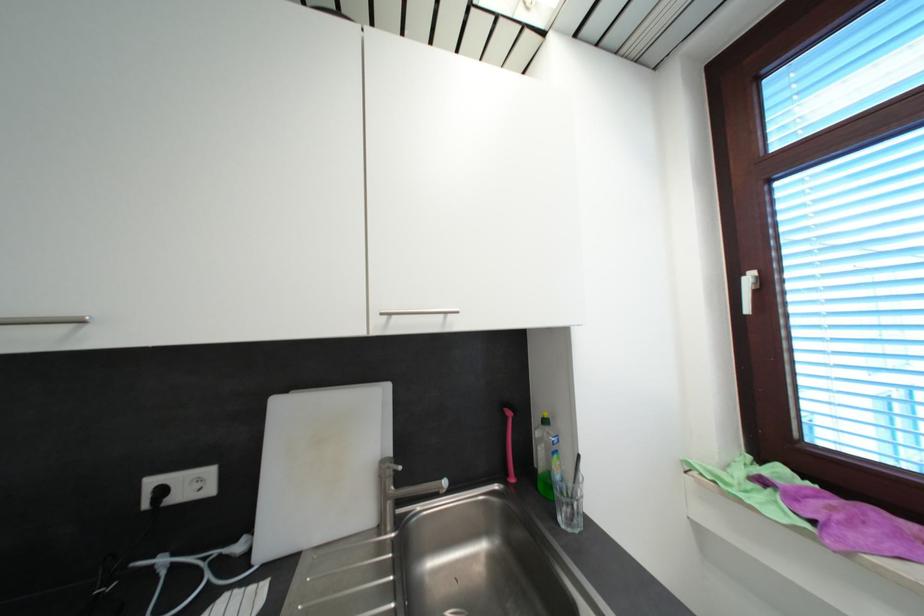
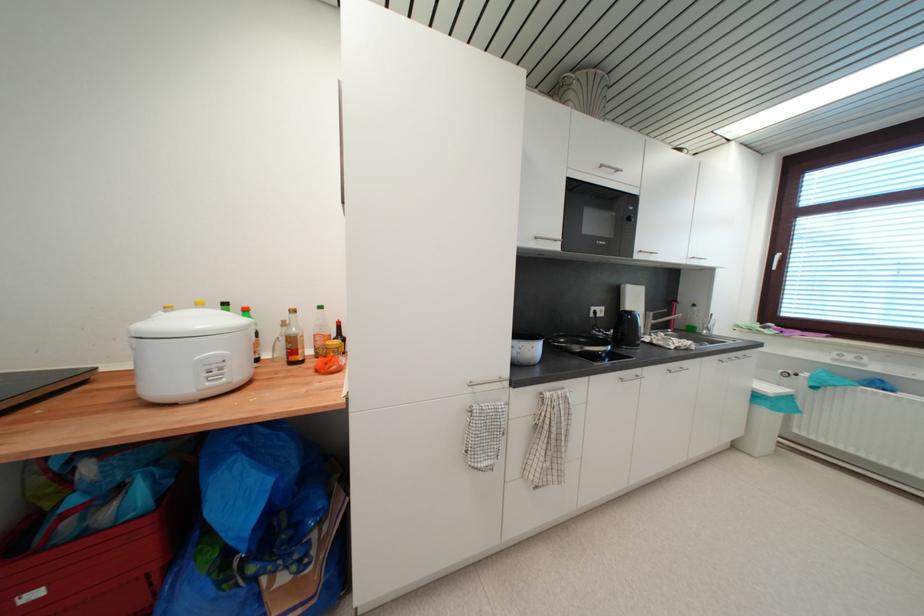
Find the pixel in the second image that matches point 152,507 in the first image.

(597, 317)